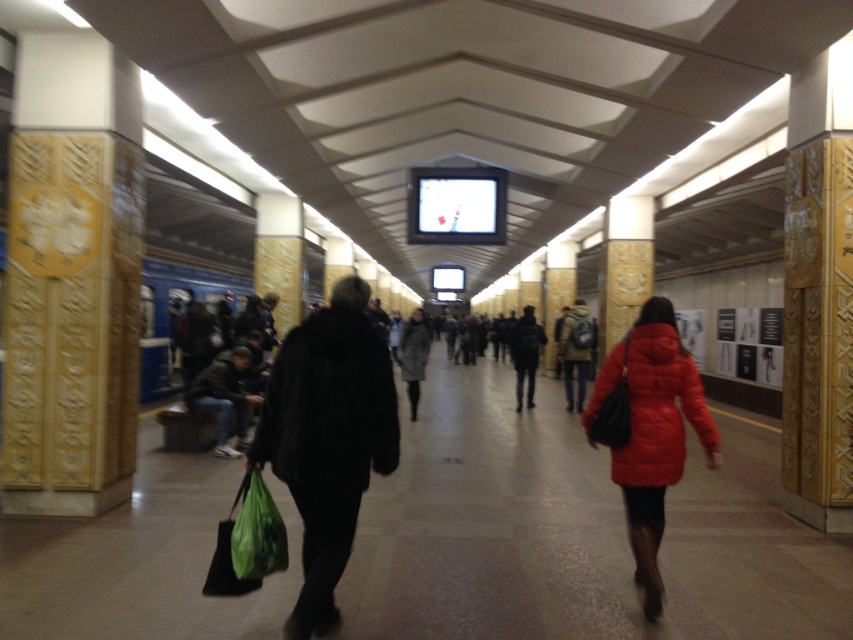
Question: Among these objects, which one is nearest to the camera?

Choices:
 (A) gray wool coat at center
 (B) black fur coat at center
 (C) matte red jacket at right

Answer: (B)

Question: Which point is farther from the camera taking this photo?

Choices:
 (A) (300, 426)
 (B) (416, 346)
 (C) (601, 378)
 (D) (582, 348)

Answer: (D)

Question: Can you confirm if black fur coat at center is bigger than gray wool coat at center?

Choices:
 (A) no
 (B) yes

Answer: (A)

Question: Which point appears closest to the camera in this image?

Choices:
 (A) (334, 339)
 (B) (520, 356)
 (C) (413, 376)
 (D) (569, 388)

Answer: (A)

Question: Where is matte red jacket at right located in relation to gray wool coat at center in the image?

Choices:
 (A) below
 (B) above

Answer: (B)

Question: Is matte black backpack at center to the left of dark gray jacket at center from the viewer's perspective?

Choices:
 (A) no
 (B) yes

Answer: (B)